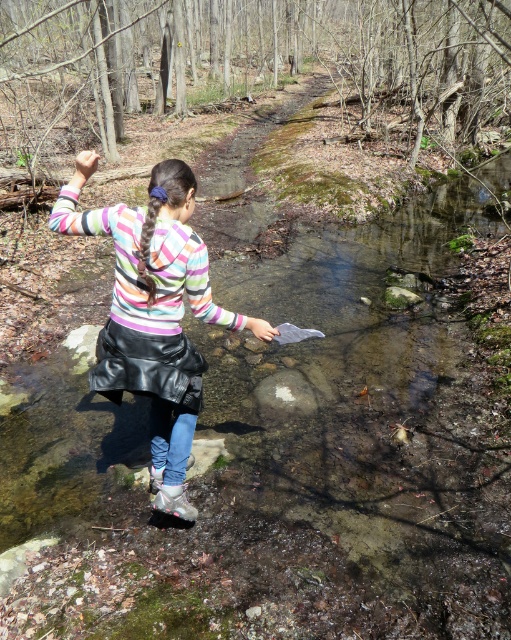
Can you confirm if leather skirt at center is positioned above matte gray boot at lower center?

Correct, leather skirt at center is located above matte gray boot at lower center.

Which is below, leather skirt at center or matte gray boot at lower center?

matte gray boot at lower center

Is point (120, 305) behind point (178, 496)?

No, (120, 305) is closer to viewer.

Find the location of `leather skirt at center`. leather skirt at center is located at coordinates (153, 307).